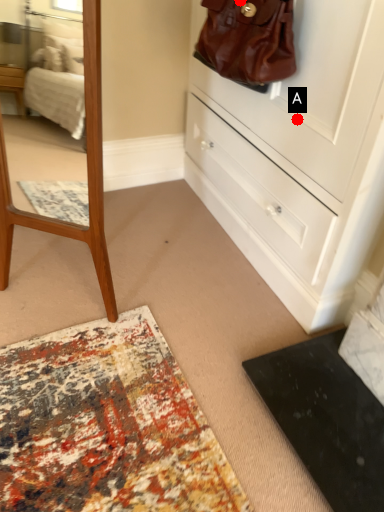
Question: Two points are circled on the image, labeled by A and B beside each circle. Among these points, which one is farthest from the camera?

Choices:
 (A) A is further
 (B) B is further

Answer: (A)